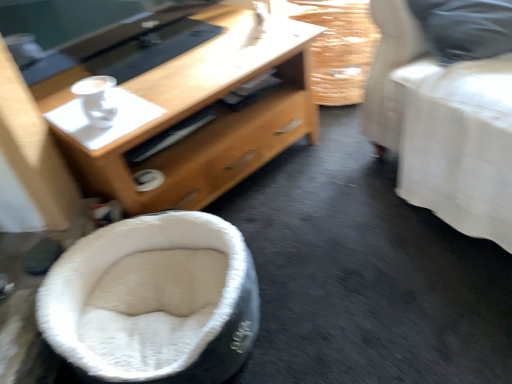
At what (x,y) coordinates should I click in order to perform the action: click on free point to the right of white fuzzy bean bag at lower left. Please return your answer as a coordinate pair (x, y). Image resolution: width=512 pixels, height=384 pixels. Looking at the image, I should click on (323, 288).